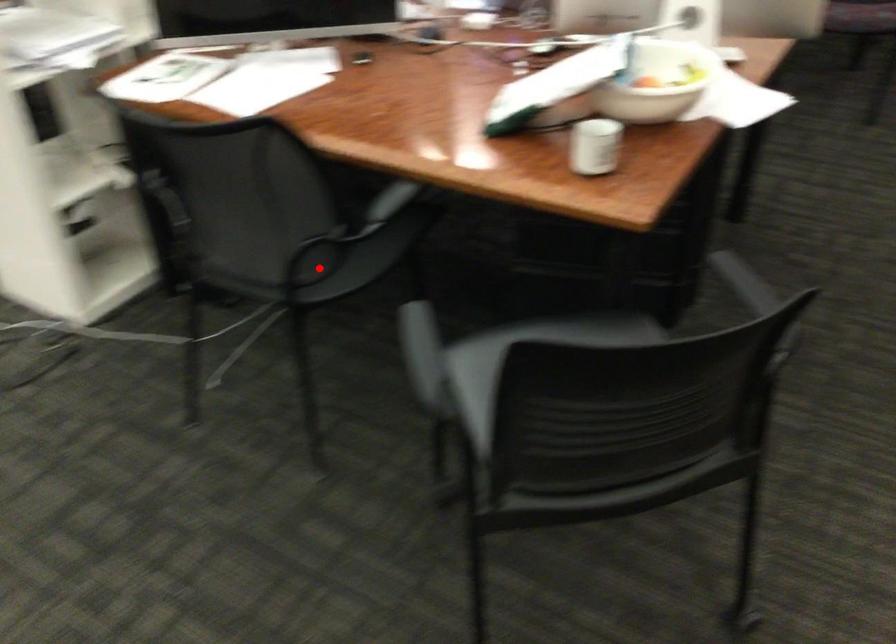
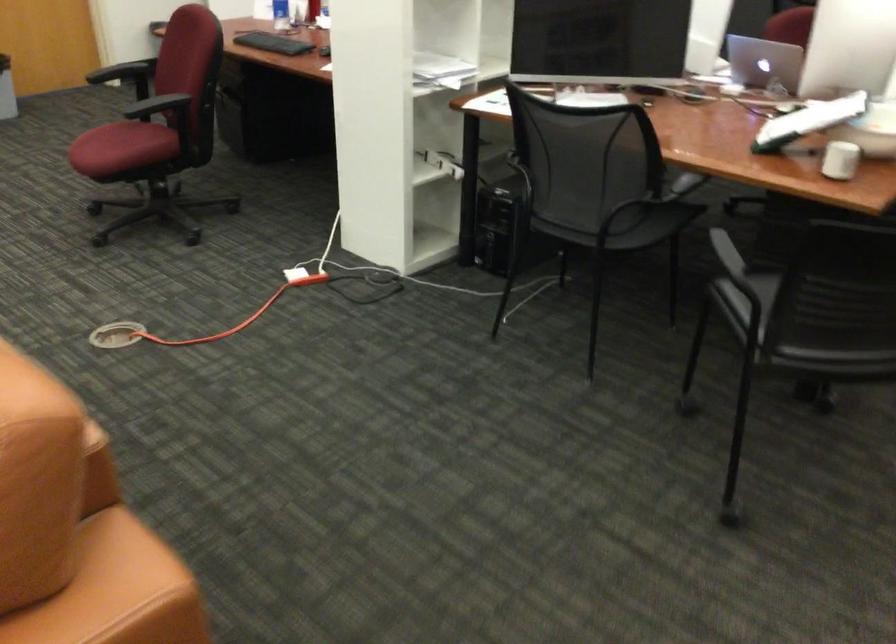
Question: I am providing you with two images of the same scene from different viewpoints. A red point is shown in image1. For the corresponding object point in image2, is it positioned nearer or farther from the camera?

Choices:
 (A) Nearer
 (B) Farther

Answer: (B)